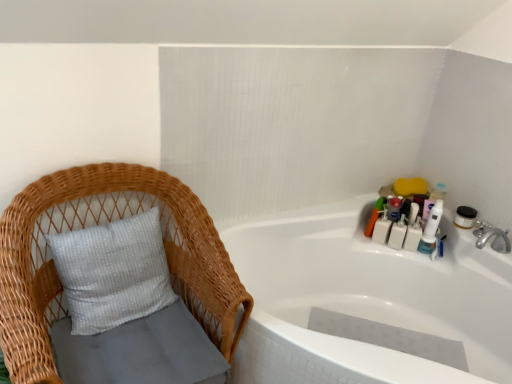
Question: Is white glossy bathtub at upper right far away from matte plastic toothbrush at upper right, the sixth toiletry when ordered from right to left?

Choices:
 (A) no
 (B) yes

Answer: (A)

Question: Can you confirm if white glossy bathtub at upper right is smaller than matte plastic toothbrush at upper right, the sixth toiletry when ordered from right to left?

Choices:
 (A) no
 (B) yes

Answer: (A)

Question: Considering the relative positions of white glossy bathtub at upper right and matte plastic toothbrush at upper right, the sixth toiletry when ordered from right to left, in the image provided, is white glossy bathtub at upper right to the left of matte plastic toothbrush at upper right, the sixth toiletry when ordered from right to left, from the viewer's perspective?

Choices:
 (A) no
 (B) yes

Answer: (B)

Question: Does white glossy bathtub at upper right have a greater height compared to matte plastic toothbrush at upper right, the sixth toiletry when ordered from right to left?

Choices:
 (A) no
 (B) yes

Answer: (B)

Question: Is white glossy bathtub at upper right aimed at matte plastic toothbrush at upper right, which is the first toiletry from left to right?

Choices:
 (A) no
 (B) yes

Answer: (A)

Question: From a real-world perspective, is white plastic bottles at upper right, the fourth toiletry in the right-to-left sequence, above or below white plastic toothbrush at upper right, which is the 6th toiletry from left to right?

Choices:
 (A) below
 (B) above

Answer: (A)

Question: In the image, is white plastic bottles at upper right, the fourth toiletry in the right-to-left sequence, positioned in front of or behind white plastic toothbrush at upper right, which is counted as the first toiletry, starting from the right?

Choices:
 (A) behind
 (B) front

Answer: (A)

Question: In the image, is white plastic bottles at upper right, positioned as the 3th toiletry in left-to-right order, on the left side or the right side of white plastic toothbrush at upper right, which is the 6th toiletry from left to right?

Choices:
 (A) right
 (B) left

Answer: (B)

Question: Is white plastic bottles at upper right, the fourth toiletry in the right-to-left sequence, taller or shorter than white plastic toothbrush at upper right, which is the 6th toiletry from left to right?

Choices:
 (A) short
 (B) tall

Answer: (A)

Question: Looking at their shapes, would you say white plastic bottles at upper right, the fourth toiletry in the right-to-left sequence, is wider or thinner than white plastic toothbrush at upper right, acting as the 2th toiletry starting from the right?

Choices:
 (A) thin
 (B) wide

Answer: (B)

Question: Would you say white plastic bottles at upper right, positioned as the 3th toiletry in left-to-right order, is inside or outside white plastic toothbrush at upper right, the 5th toiletry viewed from the left?

Choices:
 (A) inside
 (B) outside

Answer: (B)

Question: In the image, is white plastic bottles at upper right, positioned as the 3th toiletry in left-to-right order, positioned in front of or behind white plastic toothbrush at upper right, acting as the 2th toiletry starting from the right?

Choices:
 (A) front
 (B) behind

Answer: (B)

Question: In terms of height, does white plastic bottles at upper right, the fourth toiletry in the right-to-left sequence, look taller or shorter compared to white plastic toothbrush at upper right, acting as the 2th toiletry starting from the right?

Choices:
 (A) tall
 (B) short

Answer: (B)

Question: Is woven wood chair at left taller or shorter than matte plastic toothbrush at upper right, which is the first toiletry from left to right?

Choices:
 (A) tall
 (B) short

Answer: (A)

Question: Does point [234, 334] appear closer or farther from the camera than point [375, 215]?

Choices:
 (A) closer
 (B) farther

Answer: (A)